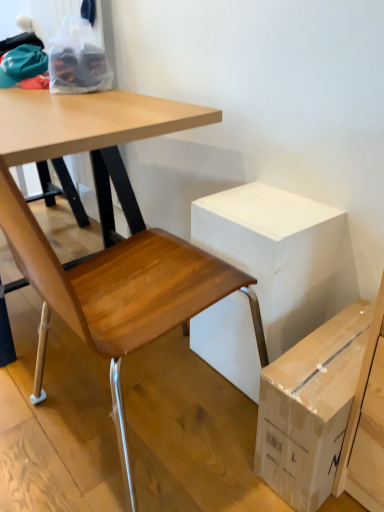
Question: In terms of size, does white cardboard box at center appear bigger or smaller than wooden chair at lower left?

Choices:
 (A) big
 (B) small

Answer: (B)

Question: In terms of width, does white cardboard box at center look wider or thinner when compared to wooden chair at lower left?

Choices:
 (A) wide
 (B) thin

Answer: (B)

Question: Estimate the real-world distances between objects in this image. Which object is farther from the wooden chair at lower left?

Choices:
 (A) brown cardboard box at lower right
 (B) white cardboard box at center

Answer: (A)

Question: Estimate the real-world distances between objects in this image. Which object is farther from the brown cardboard box at lower right?

Choices:
 (A) white cardboard box at center
 (B) wooden chair at lower left

Answer: (B)